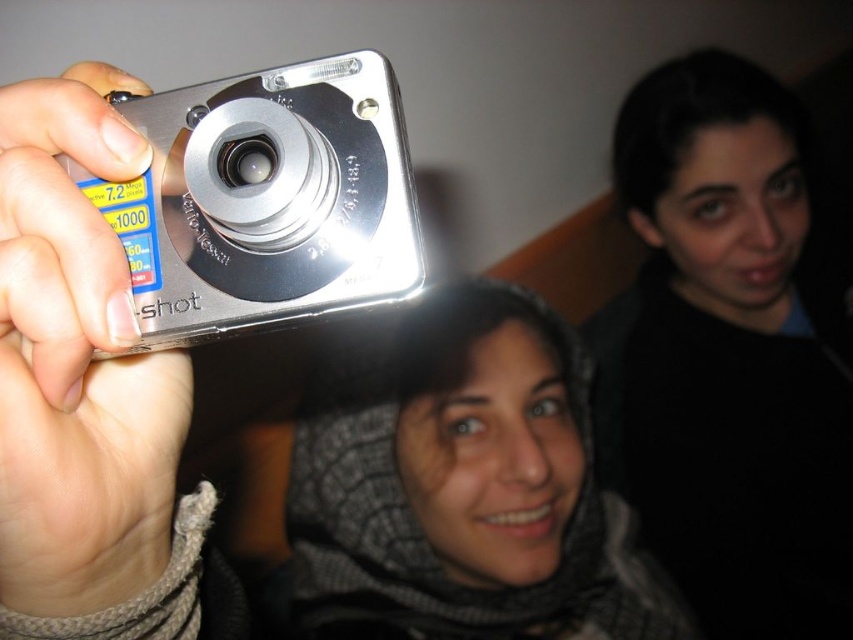
Is black matte scarf at upper center positioned behind silver metallic camera at upper left?

Yes, it is.

Is point (668, 125) closer to camera compared to point (129, 140)?

No, it is not.

Locate an element on the screen. This screenshot has height=640, width=853. black matte scarf at upper center is located at coordinates (729, 355).

Between point (312, 394) and point (54, 422), which one is positioned in front?

Point (54, 422) is in front.

Does gray knitted scarf at center appear under silver metallic camera at upper left?

Indeed, gray knitted scarf at center is positioned under silver metallic camera at upper left.

Is point (366, 433) in front of point (122, 154)?

No, (366, 433) is further to viewer.

Identify the location of gray knitted scarf at center. (463, 490).

Can you confirm if gray knitted scarf at center is shorter than silver metallic camera at left?

In fact, gray knitted scarf at center may be taller than silver metallic camera at left.

Can you confirm if gray knitted scarf at center is wider than silver metallic camera at left?

Correct, the width of gray knitted scarf at center exceeds that of silver metallic camera at left.

The width and height of the screenshot is (853, 640). I want to click on gray knitted scarf at center, so click(463, 490).